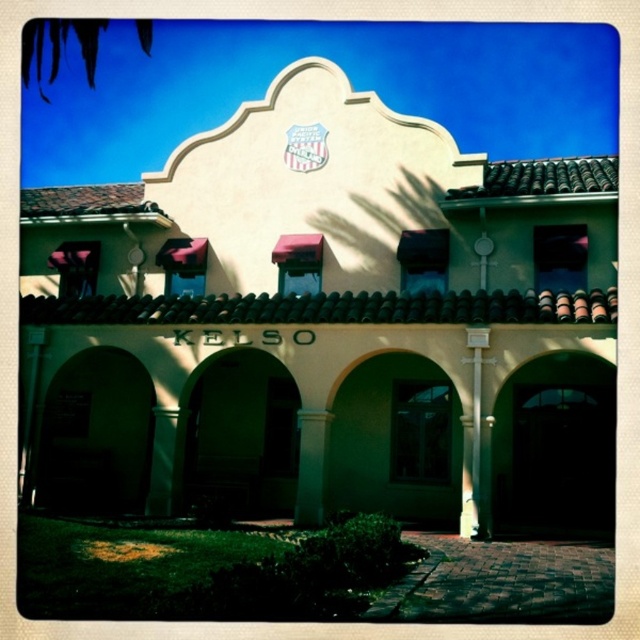
From the picture: You are standing in front of the Spanish Colonial Revival building with the word KELSO displayed. There are two points marked on the building facade at coordinates point [300,410] and point [170,424]. From your perspective, which point is closer to you?

Point [300,410] is in front of point [170,424], so it is closer to you.

You are standing in front of the building and want to take a photo of the green stone column at center. Where should you position yourself to capture it in the frame?

The green stone column at center is located at point (x=310, y=465), so you should position yourself directly in front of the building at the center to capture it in the frame.